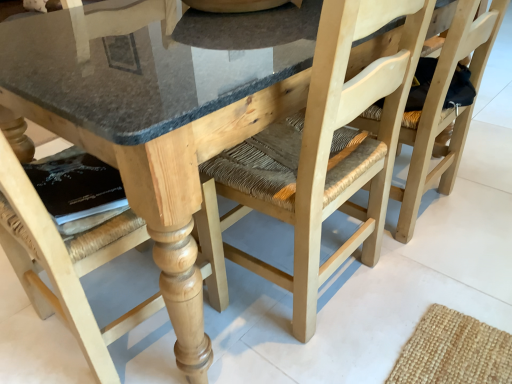
Image resolution: width=512 pixels, height=384 pixels. What do you see at coordinates (449, 110) in the screenshot?
I see `natural wood chair at center, the first chair positioned from the right` at bounding box center [449, 110].

This screenshot has height=384, width=512. What do you see at coordinates (66, 262) in the screenshot? I see `natural wood chair at lower left, placed as the first chair when sorted from left to right` at bounding box center [66, 262].

I want to click on natural wood chair at center, positioned as the third chair in left-to-right order, so click(x=449, y=110).

Is point (62, 275) closer or farther from the camera than point (464, 9)?

Clearly, point (62, 275) is closer to the camera than point (464, 9).

Can you confirm if natural wood chair at lower left, placed as the first chair when sorted from left to right, is taller than natural wood chair at center, positioned as the third chair in left-to-right order?

Yes, natural wood chair at lower left, placed as the first chair when sorted from left to right, is taller than natural wood chair at center, positioned as the third chair in left-to-right order.

From the picture: From the image's perspective, which is below, natural wood chair at lower left, the 3th chair in the right-to-left sequence, or natural wood chair at center, positioned as the third chair in left-to-right order?

natural wood chair at lower left, the 3th chair in the right-to-left sequence, from the image's perspective.

From a real-world perspective, is natural wood chair at lower left, the 3th chair in the right-to-left sequence, positioned under natural wood chair at center, the first chair positioned from the right, based on gravity?

No, from a real-world perspective, natural wood chair at lower left, the 3th chair in the right-to-left sequence, is not under natural wood chair at center, the first chair positioned from the right.

Is natural wood chair at center, positioned as the third chair in left-to-right order, facing away from natural wood chair at lower left, placed as the first chair when sorted from left to right?

No, natural wood chair at lower left, placed as the first chair when sorted from left to right, is not at the back of natural wood chair at center, positioned as the third chair in left-to-right order.

Looking at this image, which of these two, natural wood chair at center, the first chair positioned from the right, or natural wood chair at lower left, placed as the first chair when sorted from left to right, is bigger?

natural wood chair at lower left, placed as the first chair when sorted from left to right.

From a real-world perspective, is natural wood chair at center, the first chair positioned from the right, physically located above or below natural wood chair at lower left, placed as the first chair when sorted from left to right?

natural wood chair at center, the first chair positioned from the right, is situated lower than natural wood chair at lower left, placed as the first chair when sorted from left to right, in the real world.

Which point is more forward, (460, 34) or (143, 237)?

The point (143, 237) is more forward.

Is natural wood chair at lower left, placed as the first chair when sorted from left to right, beside natural wood chair at center, acting as the 2th chair starting from the right?

natural wood chair at lower left, placed as the first chair when sorted from left to right, and natural wood chair at center, acting as the 2th chair starting from the right, are clearly separated.

From the image's perspective, is natural wood chair at lower left, the 3th chair in the right-to-left sequence, below natural wood chair at center, acting as the 2th chair starting from the right?

Indeed, from the image's perspective, natural wood chair at lower left, the 3th chair in the right-to-left sequence, is shown beneath natural wood chair at center, acting as the 2th chair starting from the right.

Looking at this image, considering the relative sizes of natural wood chair at lower left, placed as the first chair when sorted from left to right, and natural wood chair at center, the second chair positioned from the left, in the image provided, is natural wood chair at lower left, placed as the first chair when sorted from left to right, thinner than natural wood chair at center, the second chair positioned from the left,?

Yes, natural wood chair at lower left, placed as the first chair when sorted from left to right, is thinner than natural wood chair at center, the second chair positioned from the left.

Is point (388, 16) closer to camera compared to point (497, 4)?

Yes, it is.

Considering the positions of objects natural wood chair at center, acting as the 2th chair starting from the right, and natural wood chair at center, the first chair positioned from the right, in the image provided, who is more to the left, natural wood chair at center, acting as the 2th chair starting from the right, or natural wood chair at center, the first chair positioned from the right,?

Positioned to the left is natural wood chair at center, acting as the 2th chair starting from the right.

Consider the image. Is natural wood chair at center, acting as the 2th chair starting from the right, turned away from natural wood chair at center, positioned as the third chair in left-to-right order?

No, natural wood chair at center, acting as the 2th chair starting from the right, is not facing the opposite direction of natural wood chair at center, positioned as the third chair in left-to-right order.

Considering the sizes of objects natural wood chair at center, acting as the 2th chair starting from the right, and natural wood chair at lower left, placed as the first chair when sorted from left to right, in the image provided, who is bigger, natural wood chair at center, acting as the 2th chair starting from the right, or natural wood chair at lower left, placed as the first chair when sorted from left to right,?

natural wood chair at lower left, placed as the first chair when sorted from left to right.

Are natural wood chair at center, the second chair positioned from the left, and natural wood chair at lower left, the 3th chair in the right-to-left sequence, beside each other?

No, natural wood chair at center, the second chair positioned from the left, is not next to natural wood chair at lower left, the 3th chair in the right-to-left sequence.

Is natural wood chair at center, the second chair positioned from the left, to the left of natural wood chair at lower left, placed as the first chair when sorted from left to right, from the viewer's perspective?

No.

Which is behind, point (324, 155) or point (69, 261)?

The point (324, 155) is farther from the camera.

Is natural wood chair at center, positioned as the third chair in left-to-right order, oriented towards natural wood chair at center, the second chair positioned from the left?

No, natural wood chair at center, positioned as the third chair in left-to-right order, is not turned towards natural wood chair at center, the second chair positioned from the left.

Based on the photo, from a real-world perspective, is natural wood chair at center, positioned as the third chair in left-to-right order, positioned under natural wood chair at center, the second chair positioned from the left, based on gravity?

Correct, in the physical world, natural wood chair at center, positioned as the third chair in left-to-right order, is lower than natural wood chair at center, the second chair positioned from the left.

From their relative heights in the image, would you say natural wood chair at center, positioned as the third chair in left-to-right order, is taller or shorter than natural wood chair at center, the second chair positioned from the left?

natural wood chair at center, positioned as the third chair in left-to-right order, is shorter than natural wood chair at center, the second chair positioned from the left.

Looking at the image, does natural wood chair at center, the first chair positioned from the right, seem bigger or smaller compared to natural wood chair at center, the second chair positioned from the left?

natural wood chair at center, the first chair positioned from the right, is smaller than natural wood chair at center, the second chair positioned from the left.

This screenshot has width=512, height=384. What are the coordinates of `the 2nd chair below when counting from the natural wood chair at center, positioned as the third chair in left-to-right order (from the image's perspective)` in the screenshot? It's located at (66, 262).

The height and width of the screenshot is (384, 512). I want to click on the 2nd chair to the left of the natural wood chair at center, positioned as the third chair in left-to-right order, starting your count from the anchor, so click(66, 262).

Which object lies nearer to the anchor point natural wood chair at lower left, the 3th chair in the right-to-left sequence, natural wood chair at center, positioned as the third chair in left-to-right order, or natural wood chair at center, acting as the 2th chair starting from the right?

natural wood chair at center, acting as the 2th chair starting from the right, is closer to natural wood chair at lower left, the 3th chair in the right-to-left sequence.

Considering their positions, is natural wood chair at lower left, the 3th chair in the right-to-left sequence, positioned closer to natural wood chair at center, the second chair positioned from the left, than natural wood chair at center, positioned as the third chair in left-to-right order?

natural wood chair at center, positioned as the third chair in left-to-right order, is positioned closer to the anchor natural wood chair at center, the second chair positioned from the left.

Considering their positions, is natural wood chair at lower left, the 3th chair in the right-to-left sequence, positioned closer to natural wood chair at center, the first chair positioned from the right, than natural wood chair at center, acting as the 2th chair starting from the right?

natural wood chair at center, acting as the 2th chair starting from the right.

Considering their positions, is natural wood chair at center, positioned as the third chair in left-to-right order, positioned closer to natural wood chair at center, acting as the 2th chair starting from the right, than natural wood chair at lower left, the 3th chair in the right-to-left sequence?

natural wood chair at center, positioned as the third chair in left-to-right order, lies closer to natural wood chair at center, acting as the 2th chair starting from the right, than the other object.

Based on their spatial positions, is natural wood chair at center, the second chair positioned from the left, or natural wood chair at lower left, placed as the first chair when sorted from left to right, closer to natural wood chair at center, the first chair positioned from the right?

Among the two, natural wood chair at center, the second chair positioned from the left, is located nearer to natural wood chair at center, the first chair positioned from the right.

Based on their spatial positions, is natural wood chair at center, the second chair positioned from the left, or natural wood chair at center, positioned as the third chair in left-to-right order, further from natural wood chair at lower left, placed as the first chair when sorted from left to right?

Among the two, natural wood chair at center, positioned as the third chair in left-to-right order, is located further to natural wood chair at lower left, placed as the first chair when sorted from left to right.

Identify the location of chair between natural wood chair at lower left, the 3th chair in the right-to-left sequence, and natural wood chair at center, the first chair positioned from the right, in the horizontal direction. (327, 149).